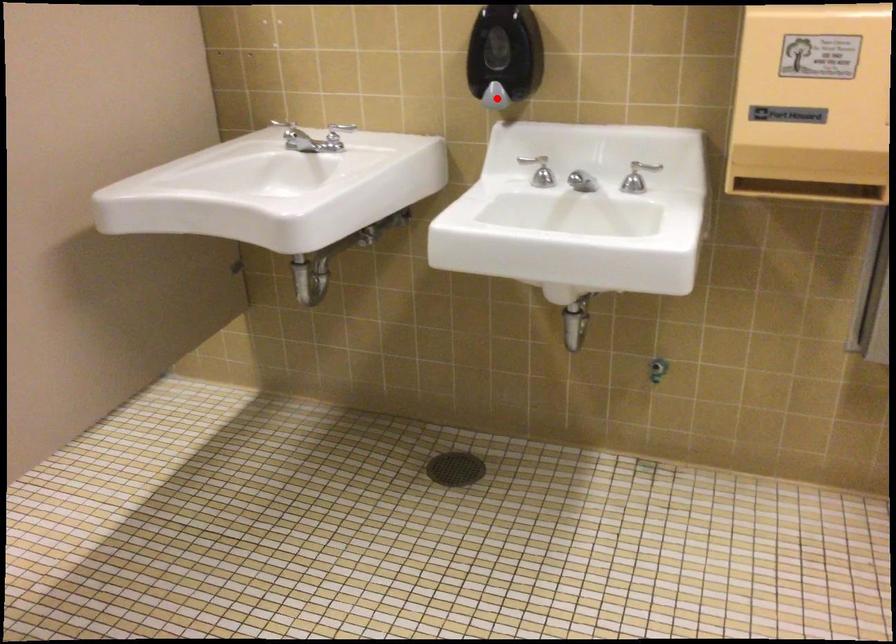
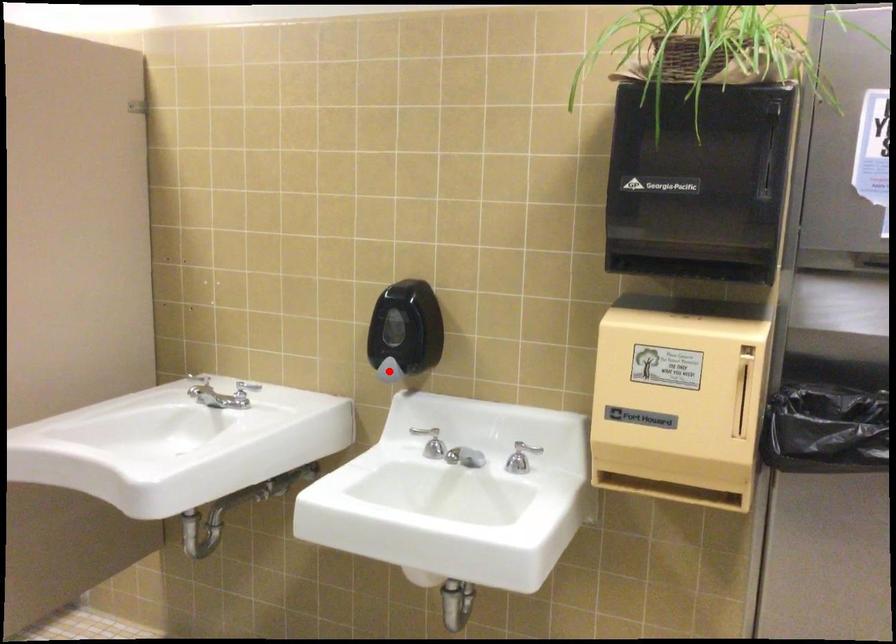
I am providing you with two images of the same scene from different viewpoints. A red point is marked on the first image and another point is marked on the second image. Are the points marked in image1 and image2 representing the same 3D position?

Yes